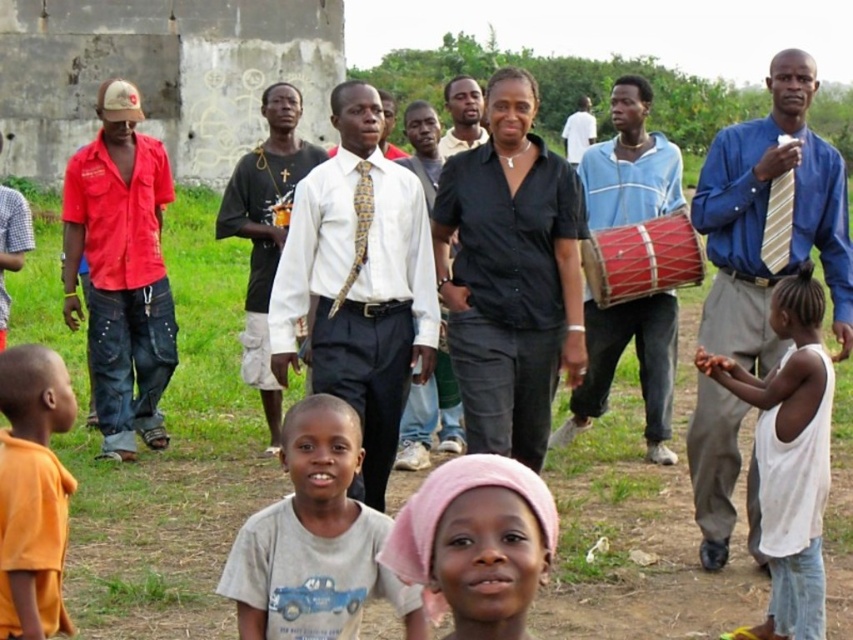
Which of these two, black matte shirt at center or gray cotton shirt at lower center, stands taller?

black matte shirt at center

In order to click on black matte shirt at center in this screenshot , I will do `click(509, 275)`.

Identify the location of black matte shirt at center. (509, 275).

Is the position of red denim shirt at left more distant than that of orange matte shirt at lower left?

Yes.

Which of these two, red denim shirt at left or orange matte shirt at lower left, stands shorter?

orange matte shirt at lower left

The height and width of the screenshot is (640, 853). What do you see at coordinates (120, 269) in the screenshot? I see `red denim shirt at left` at bounding box center [120, 269].

The image size is (853, 640). In order to click on red denim shirt at left in this screenshot , I will do `click(120, 269)`.

Who is more forward, (271, 212) or (792, 179)?

Point (792, 179)

Does black cotton shirt at center lie behind striped fabric tie at right?

Yes, black cotton shirt at center is behind striped fabric tie at right.

The image size is (853, 640). What are the coordinates of `black cotton shirt at center` in the screenshot? It's located at (265, 230).

The image size is (853, 640). In order to click on black cotton shirt at center in this screenshot , I will do `click(265, 230)`.